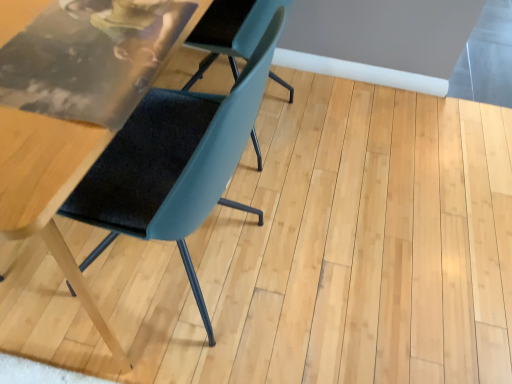
Question: From the image's perspective, relative to teal fabric chair at center, which is counted as the first chair, starting from the left, is matte blue chair at center, positioned as the 1th chair in right-to-left order, above or below?

Choices:
 (A) above
 (B) below

Answer: (A)

Question: Considering the positions of matte blue chair at center, positioned as the 1th chair in right-to-left order, and teal fabric chair at center, the 2th chair viewed from the right, in the image, is matte blue chair at center, positioned as the 1th chair in right-to-left order, wider or thinner than teal fabric chair at center, the 2th chair viewed from the right,?

Choices:
 (A) wide
 (B) thin

Answer: (B)

Question: Considering the positions of matte blue chair at center, positioned as the 1th chair in right-to-left order, and teal fabric chair at center, the 2th chair viewed from the right, in the image, is matte blue chair at center, positioned as the 1th chair in right-to-left order, bigger or smaller than teal fabric chair at center, the 2th chair viewed from the right,?

Choices:
 (A) small
 (B) big

Answer: (A)

Question: Is teal fabric chair at center, which is counted as the first chair, starting from the left, situated inside matte blue chair at center, positioned as the 1th chair in right-to-left order, or outside?

Choices:
 (A) inside
 (B) outside

Answer: (B)

Question: Considering the positions of teal fabric chair at center, which is counted as the first chair, starting from the left, and matte blue chair at center, which appears as the second chair when viewed from the left, in the image, is teal fabric chair at center, which is counted as the first chair, starting from the left, bigger or smaller than matte blue chair at center, which appears as the second chair when viewed from the left,?

Choices:
 (A) big
 (B) small

Answer: (A)

Question: Considering the relative positions of teal fabric chair at center, which is counted as the first chair, starting from the left, and matte blue chair at center, which appears as the second chair when viewed from the left, in the image provided, is teal fabric chair at center, which is counted as the first chair, starting from the left, to the left or to the right of matte blue chair at center, which appears as the second chair when viewed from the left,?

Choices:
 (A) left
 (B) right

Answer: (A)

Question: From a real-world perspective, relative to matte blue chair at center, which appears as the second chair when viewed from the left, is teal fabric chair at center, the 2th chair viewed from the right, vertically above or below?

Choices:
 (A) above
 (B) below

Answer: (A)